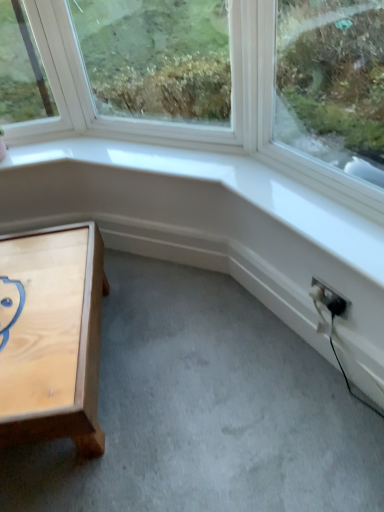
Question: In terms of width, does light wood table at lower left look wider or thinner when compared to black plastic electric outlet at lower right?

Choices:
 (A) wide
 (B) thin

Answer: (A)

Question: From the image's perspective, is light wood table at lower left above or below black plastic electric outlet at lower right?

Choices:
 (A) below
 (B) above

Answer: (A)

Question: Would you say light wood table at lower left is inside or outside black plastic electric outlet at lower right?

Choices:
 (A) inside
 (B) outside

Answer: (B)

Question: Is point (329, 306) positioned closer to the camera than point (52, 339)?

Choices:
 (A) closer
 (B) farther

Answer: (B)

Question: Relative to light wood table at lower left, is black plastic electric outlet at lower right in front or behind?

Choices:
 (A) behind
 (B) front

Answer: (A)

Question: Based on their sizes in the image, would you say black plastic electric outlet at lower right is bigger or smaller than light wood table at lower left?

Choices:
 (A) small
 (B) big

Answer: (A)

Question: In terms of width, does black plastic electric outlet at lower right look wider or thinner when compared to light wood table at lower left?

Choices:
 (A) wide
 (B) thin

Answer: (B)